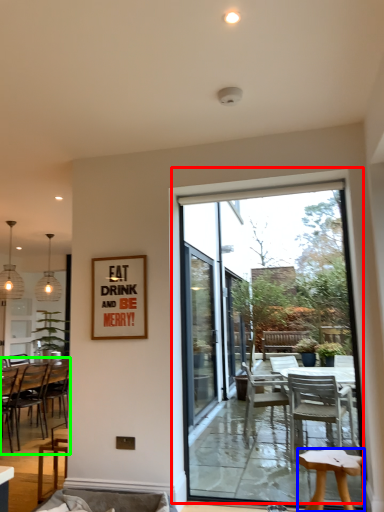
Question: Considering the real-world distances, which object is farthest from window (highlighted by a red box)? stool (highlighted by a blue box) or chair (highlighted by a green box)?

Choices:
 (A) stool
 (B) chair

Answer: (B)